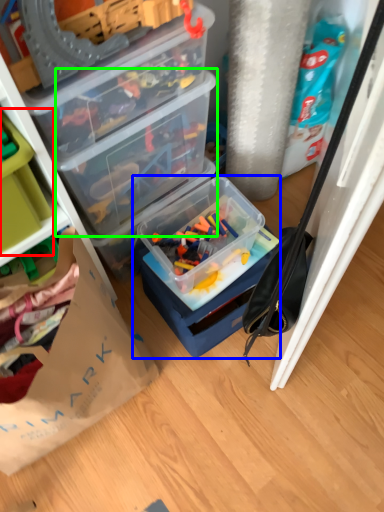
Question: Considering the real-world distances, which object is farthest from storage box (highlighted by a red box)? box (highlighted by a blue box) or box (highlighted by a green box)?

Choices:
 (A) box
 (B) box

Answer: (A)